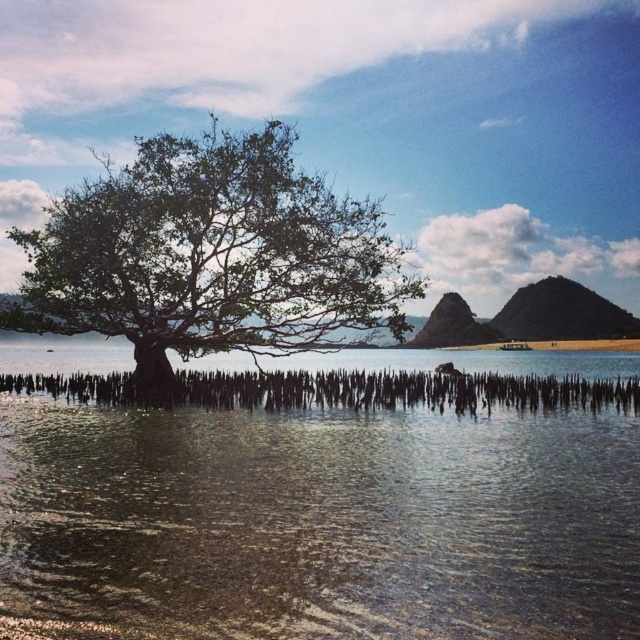
Can you confirm if clear water at center is wider than green leafy tree at center?

Indeed, clear water at center has a greater width compared to green leafy tree at center.

Which is in front, point (323, 477) or point (237, 236)?

Point (323, 477) is in front.

Locate an element on the screen. The image size is (640, 640). clear water at center is located at coordinates (321, 522).